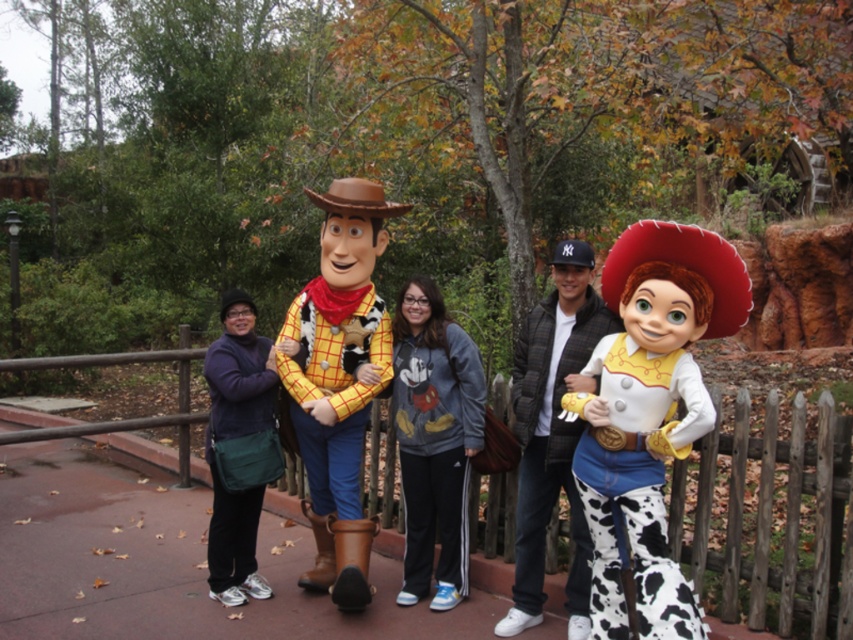
Is cowprint fabric cowboy at center to the left of gray fleece sweatshirt at center from the viewer's perspective?

In fact, cowprint fabric cowboy at center is to the right of gray fleece sweatshirt at center.

Is cowprint fabric cowboy at center smaller than gray fleece sweatshirt at center?

No.

Is point (581, 346) positioned behind point (457, 458)?

No, (581, 346) is closer to viewer.

Locate an element on the screen. cowprint fabric cowboy at center is located at coordinates (553, 433).

Is cow print fabric cowboy hat at right to the left of gray fleece sweatshirt at center from the viewer's perspective?

No, cow print fabric cowboy hat at right is not to the left of gray fleece sweatshirt at center.

Can you confirm if cow print fabric cowboy hat at right is thinner than gray fleece sweatshirt at center?

Incorrect, cow print fabric cowboy hat at right's width is not less than gray fleece sweatshirt at center's.

Is point (705, 428) positioned after point (424, 394)?

No, (705, 428) is in front of (424, 394).

You are a GUI agent. You are given a task and a screenshot of the screen. Output one action in this format:
    pyautogui.click(x=<x>, y=<y>)
    Task: Click on the cow print fabric cowboy hat at right
    This screenshot has height=640, width=853.
    Given the screenshot: What is the action you would take?
    pyautogui.click(x=650, y=412)

Can you confirm if cow print fabric cowboy hat at right is bigger than matte yellow shirt at center?

No.

Who is positioned more to the right, cow print fabric cowboy hat at right or matte yellow shirt at center?

Positioned to the right is cow print fabric cowboy hat at right.

I want to click on cow print fabric cowboy hat at right, so click(x=650, y=412).